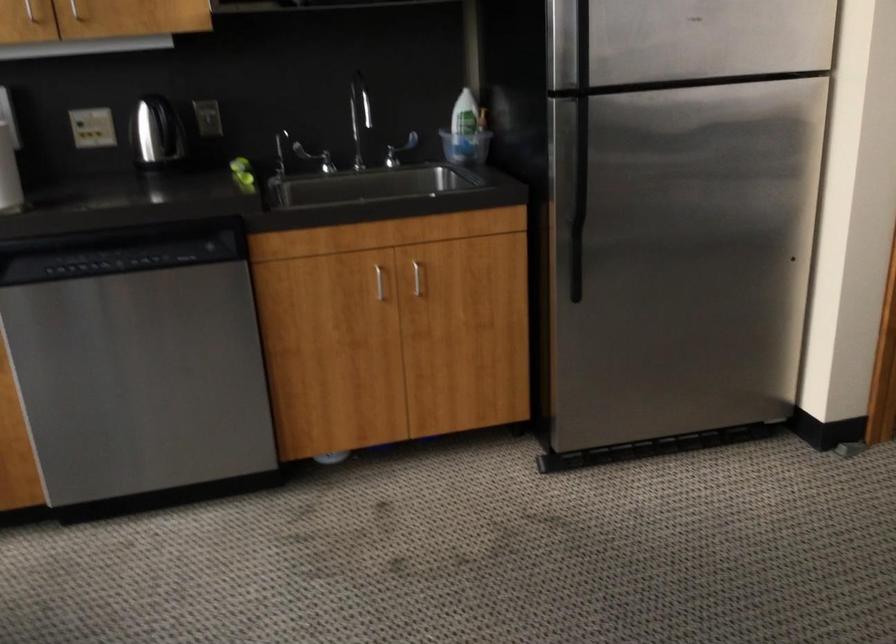
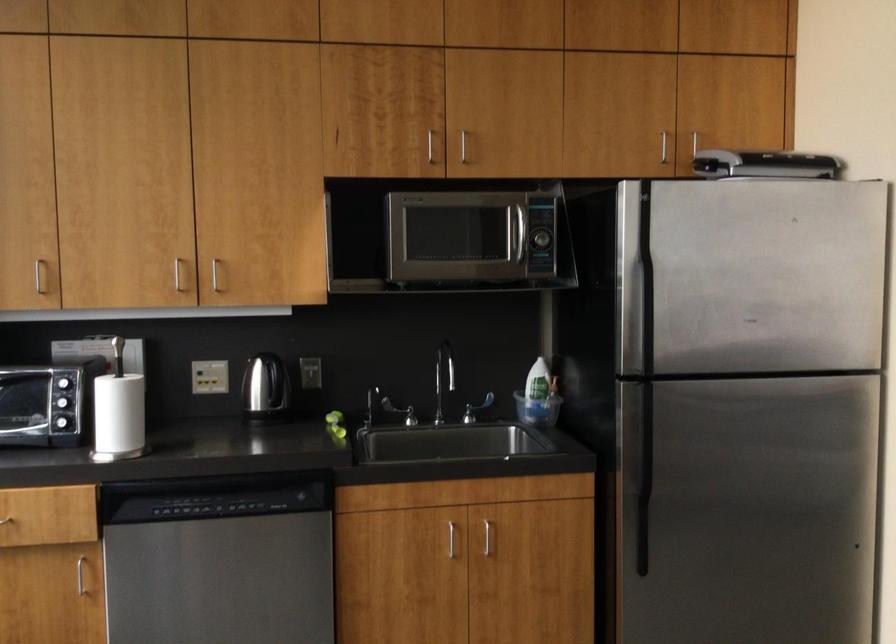
Locate, in the second image, the point that corresponds to pixel 419 283 in the first image.

(490, 542)